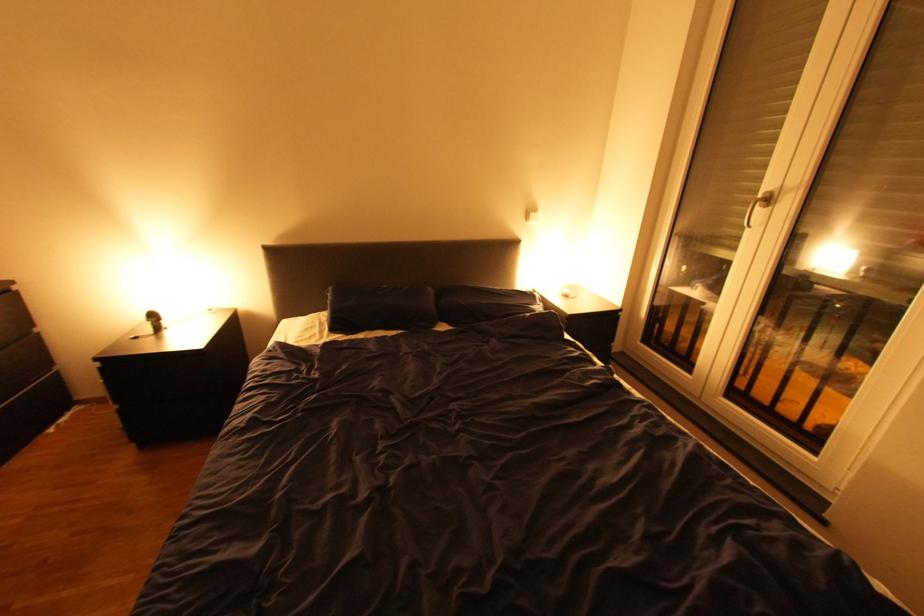
Find where to lift the dark blue pillow. Please return your answer as a coordinate pair (x, y).

(380, 308)